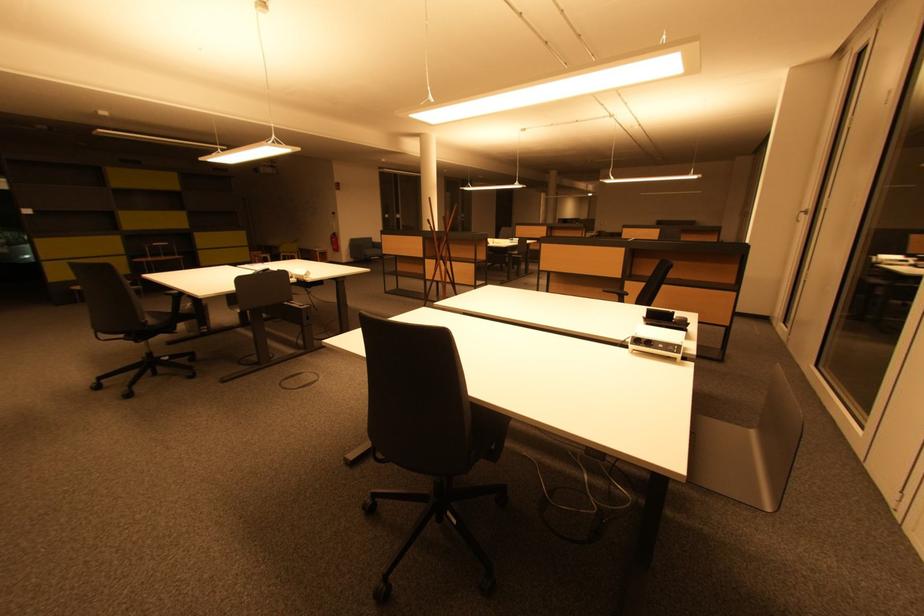
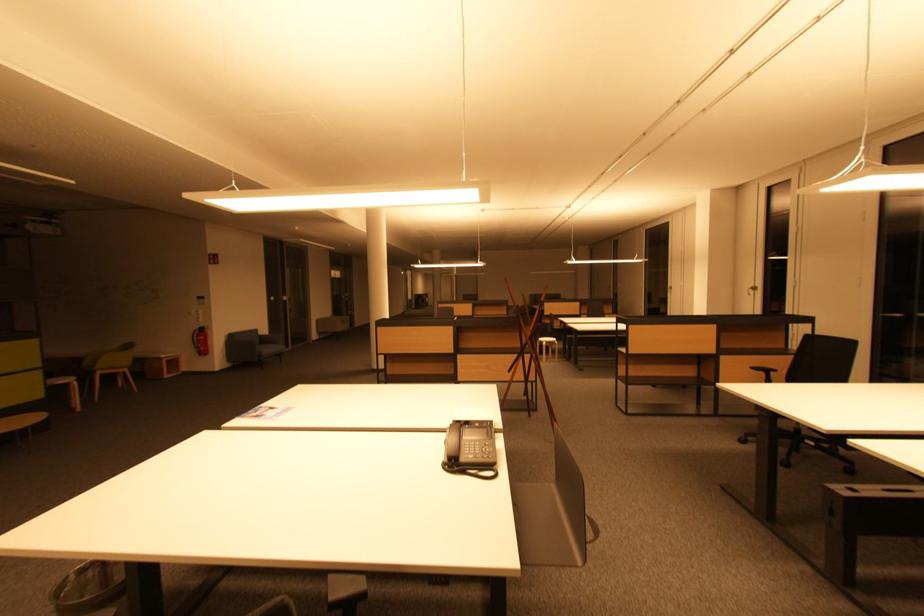
Find the pixel in the second image that matches [621,299] in the first image.

(767, 376)